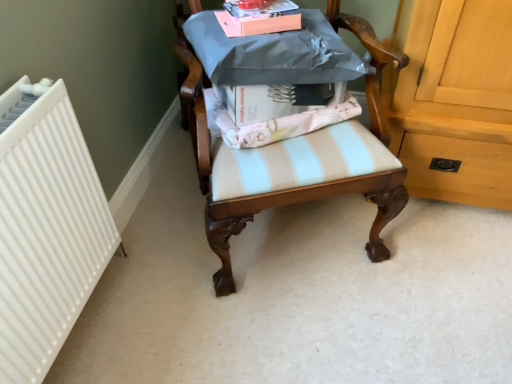
Question: Considering the relative sizes of white ribbed radiator at left and wooden chair at center in the image provided, is white ribbed radiator at left bigger than wooden chair at center?

Choices:
 (A) yes
 (B) no

Answer: (B)

Question: Is white ribbed radiator at left turned away from wooden chair at center?

Choices:
 (A) no
 (B) yes

Answer: (A)

Question: From the image's perspective, would you say white ribbed radiator at left is positioned over wooden chair at center?

Choices:
 (A) yes
 (B) no

Answer: (B)

Question: Does white ribbed radiator at left come in front of wooden chair at center?

Choices:
 (A) no
 (B) yes

Answer: (A)

Question: Considering the relative positions of white ribbed radiator at left and wooden chair at center in the image provided, is white ribbed radiator at left to the right of wooden chair at center from the viewer's perspective?

Choices:
 (A) no
 (B) yes

Answer: (A)

Question: Relative to wooden chair at center, is white ribbed radiator at left in front or behind?

Choices:
 (A) front
 (B) behind

Answer: (B)

Question: From the image's perspective, is white ribbed radiator at left above or below wooden chair at center?

Choices:
 (A) above
 (B) below

Answer: (B)

Question: Is white ribbed radiator at left wider or thinner than wooden chair at center?

Choices:
 (A) thin
 (B) wide

Answer: (A)

Question: From a real-world perspective, relative to wooden chair at center, is white ribbed radiator at left vertically above or below?

Choices:
 (A) above
 (B) below

Answer: (B)

Question: In the image, is wooden chair at center positioned in front of or behind pink matte box at upper center?

Choices:
 (A) front
 (B) behind

Answer: (A)

Question: Considering the relative positions of wooden chair at center and pink matte box at upper center in the image provided, is wooden chair at center to the left or to the right of pink matte box at upper center?

Choices:
 (A) left
 (B) right

Answer: (B)

Question: Looking at their shapes, would you say wooden chair at center is wider or thinner than pink matte box at upper center?

Choices:
 (A) thin
 (B) wide

Answer: (B)

Question: Is wooden chair at center taller or shorter than pink matte box at upper center?

Choices:
 (A) tall
 (B) short

Answer: (A)

Question: Considering the positions of wooden chair at center and white ribbed radiator at left in the image, is wooden chair at center taller or shorter than white ribbed radiator at left?

Choices:
 (A) tall
 (B) short

Answer: (A)

Question: In terms of size, does wooden chair at center appear bigger or smaller than white ribbed radiator at left?

Choices:
 (A) big
 (B) small

Answer: (A)